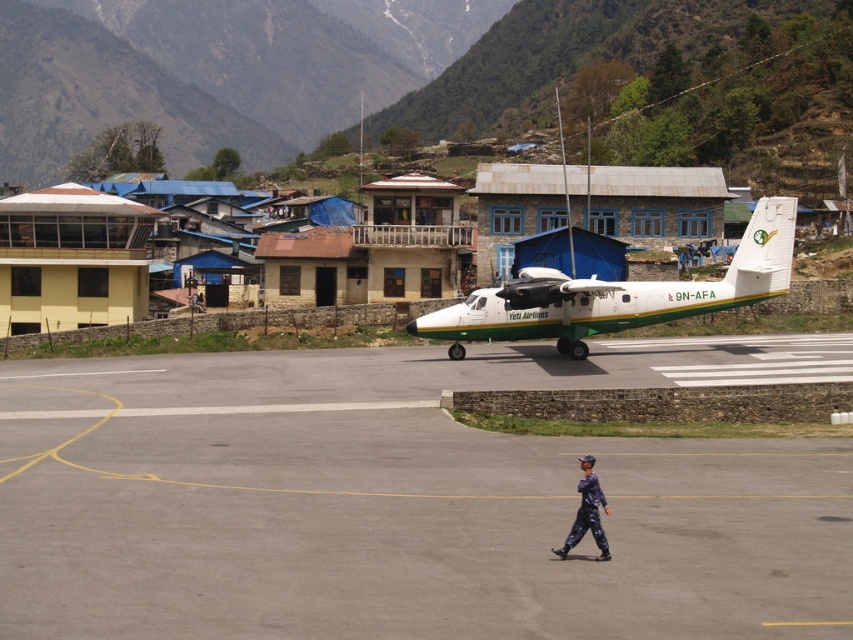
You are a drone operator who needs to fly your drone from your current position to the white matte airplane at center. According to the image, what is the approximate distance you need to cover?

The white matte airplane at center and camera are 35.03 meters apart, so the approximate distance you need to cover is 35.03 meters.

You are a photographer standing on the tarmac and want to capture a photo of the white matte airplane at center and the purple fabric pants at center in the same frame. Based on their sizes, which object will appear larger in the photo?

The white matte airplane at center will appear larger in the photo because it is much taller than the purple fabric pants at center.

You are a pilot preparing to board the white matte airplane at center. You need to walk from the gray asphalt tarmac at center to the airplane. Is the tarmac large enough to accommodate both the airplane and your path to it?

Result: The gray asphalt tarmac at center is smaller than the white matte airplane at center. Therefore, the tarmac may not be large enough to accommodate both the airplane and a clear path for you to walk to it safely.